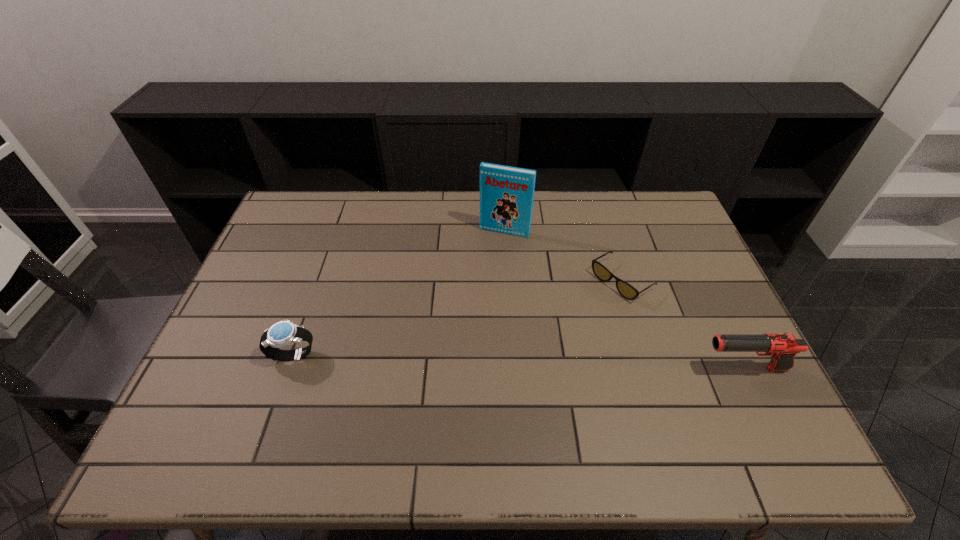
Locate an element on the screen. free space on the desktop that is between the leftmost object and the rightmost object and is positioned on the front cover of the tallest object is located at coordinates (455, 360).

Where is `free space on the desktop that is between the leftmost object and the third shortest object and is positioned on the front-facing side of the sunglasses`? The image size is (960, 540). free space on the desktop that is between the leftmost object and the third shortest object and is positioned on the front-facing side of the sunglasses is located at coordinates (505, 361).